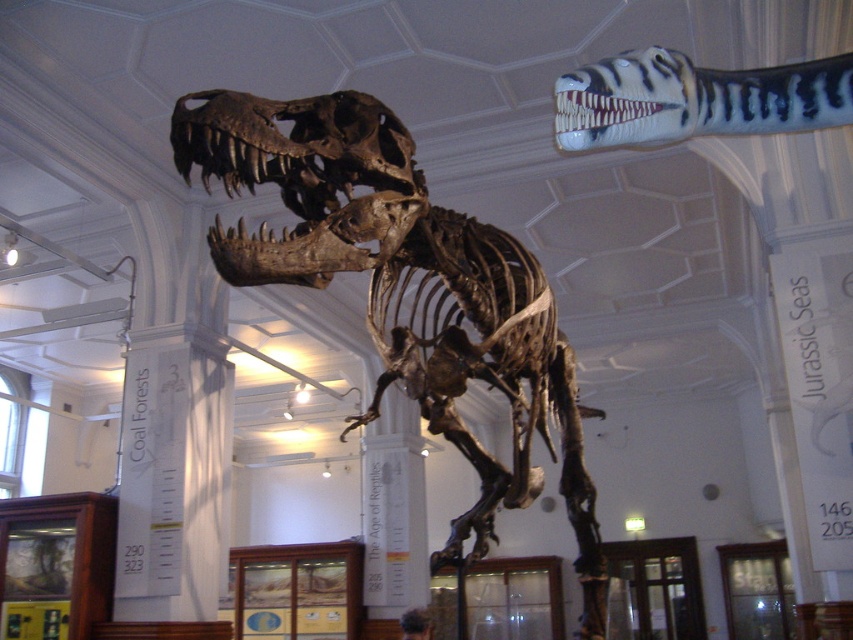
Which is behind, point (457, 253) or point (828, 68)?

Point (457, 253)

What do you see at coordinates (405, 289) in the screenshot? I see `brown bone skeleton at center` at bounding box center [405, 289].

Locate an element on the screen. This screenshot has width=853, height=640. brown bone skeleton at center is located at coordinates (405, 289).